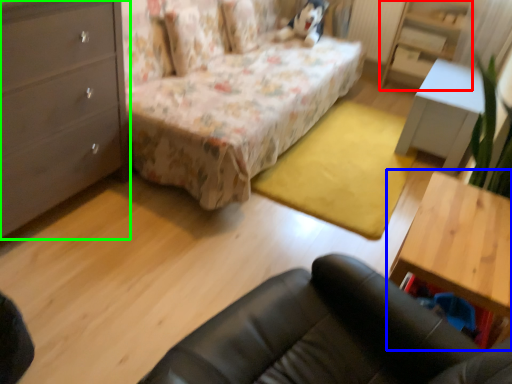
Question: Which object is positioned farthest from dresser (highlighted by a red box)? Select from table (highlighted by a blue box) and chest of drawers (highlighted by a green box).

Choices:
 (A) table
 (B) chest of drawers

Answer: (B)